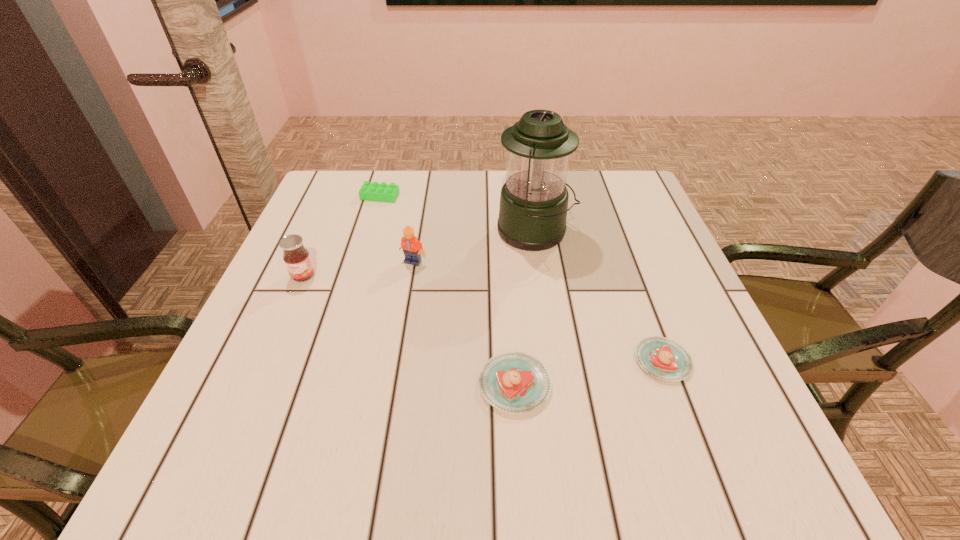
The image size is (960, 540). In order to click on the taller Lego in this screenshot , I will do `click(412, 248)`.

At what (x,y) coordinates should I click in order to perform the action: click on free spot located 0.120m on the back of the taller pastry. Please return your answer as a coordinate pair (x, y). Looking at the image, I should click on (510, 307).

In order to click on free space located 0.060m on the front of the rightmost object in this screenshot , I will do `click(683, 416)`.

This screenshot has height=540, width=960. What are the coordinates of `blank space located 0.210m on the right of the farthest object` in the screenshot? It's located at (476, 197).

You are a GUI agent. You are given a task and a screenshot of the screen. Output one action in this format:
    pyautogui.click(x=<x>, y=<y>)
    Task: Click on the vacant position located 0.120m on the back of the fifth nearest object
    
    Given the screenshot: What is the action you would take?
    pyautogui.click(x=528, y=187)

Find the location of a particular element. free space located on the label side of the third nearest object is located at coordinates (291, 305).

At what (x,y) coordinates should I click in order to perform the action: click on vacant space located 0.220m on the front-facing side of the right Lego. Please return your answer as a coordinate pair (x, y). This screenshot has height=540, width=960. Looking at the image, I should click on (399, 345).

Where is `Lego located at the far edge`? Lego located at the far edge is located at coordinates (383, 192).

This screenshot has height=540, width=960. I want to click on lantern at the far edge, so pos(533,208).

Find the location of a particular element. Image resolution: width=960 pixels, height=540 pixels. Lego that is at the left edge is located at coordinates (383, 192).